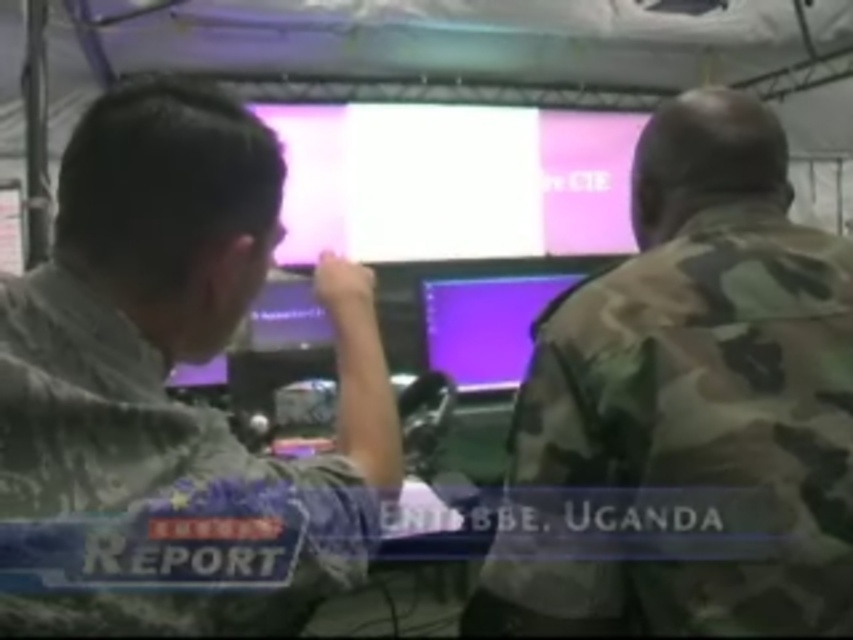
You are an observer in the scene. There is a camo uniform at center and a pink glossy monitor at center. Which object is located to the left of the other?

The camo uniform at center is positioned on the right side of pink glossy monitor at center, so the pink glossy monitor at center is to the left of the camo uniform at center.

You are a technician assessing the workstation setup. The camouflage uniform at center and the pink glossy monitor at center are both in your view. Which object appears smaller in size?

The camouflage uniform at center appears smaller in size compared to the pink glossy monitor at center according to the description.